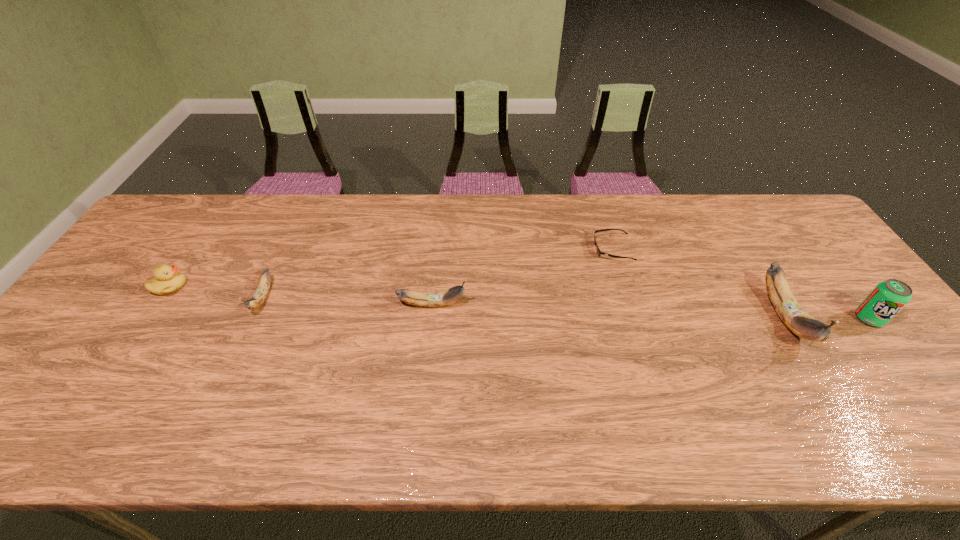
Please determine a free point for an extra banana to ensure balance. Please provide its 2D coordinates. Your answer should be formatted as a tuple, i.e. [(x, y)], where the tuple contains the x and y coordinates of a point satisfying the conditions above.

[(606, 310)]